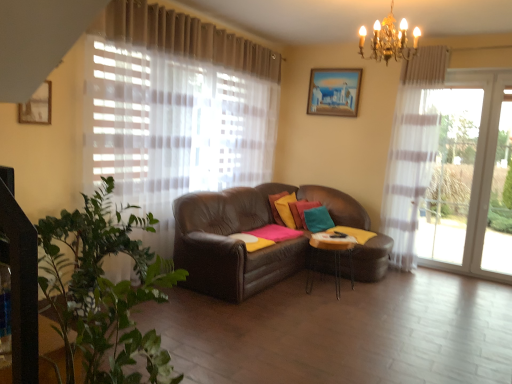
Measure the distance between point [316,97] and camera.

The depth of point [316,97] is 5.96 meters.

The image size is (512, 384). What do you see at coordinates (392, 39) in the screenshot?
I see `gold metallic chandelier at upper center` at bounding box center [392, 39].

The width and height of the screenshot is (512, 384). Find the location of `matte yellow pillow at center, acting as the 2th pillow starting from the right`. matte yellow pillow at center, acting as the 2th pillow starting from the right is located at coordinates (305, 209).

Where is `wooden picture frame at upper left, the 2th picture frame from the back`? This screenshot has width=512, height=384. wooden picture frame at upper left, the 2th picture frame from the back is located at coordinates (37, 106).

In order to click on teal fabric pillow at center, arranged as the third pillow when viewed from the left in this screenshot , I will do [318, 219].

Measure the distance between point (320, 209) and camera.

Point (320, 209) is 5.10 meters from camera.

The height and width of the screenshot is (384, 512). What do you see at coordinates (286, 209) in the screenshot?
I see `velvet yellow pillow at center, the third pillow positioned from the right` at bounding box center [286, 209].

Where is `wooden painted picture frame at upper center, which is the 2th picture frame from bottom to top`? Image resolution: width=512 pixels, height=384 pixels. wooden painted picture frame at upper center, which is the 2th picture frame from bottom to top is located at coordinates (334, 92).

Considering the relative positions of matte yellow pillow at center, which is counted as the second pillow, starting from the left, and velvet yellow pillow at center, the third pillow positioned from the right, in the image provided, is matte yellow pillow at center, which is counted as the second pillow, starting from the left, to the right of velvet yellow pillow at center, the third pillow positioned from the right, from the viewer's perspective?

Yes.

From a real-world perspective, does matte yellow pillow at center, which is counted as the second pillow, starting from the left, sit lower than velvet yellow pillow at center, the third pillow positioned from the right?

Yes, from a real-world perspective, matte yellow pillow at center, which is counted as the second pillow, starting from the left, is below velvet yellow pillow at center, the third pillow positioned from the right.

Is matte yellow pillow at center, which is counted as the second pillow, starting from the left, turned away from velvet yellow pillow at center, marked as the first pillow in a left-to-right arrangement?

Correct, matte yellow pillow at center, which is counted as the second pillow, starting from the left, is looking away from velvet yellow pillow at center, marked as the first pillow in a left-to-right arrangement.

Considering the positions of point (303, 219) and point (292, 196), is point (303, 219) closer or farther from the camera than point (292, 196)?

Clearly, point (303, 219) is closer to the camera than point (292, 196).

From the image's perspective, relative to wooden picture frame at upper left, the first picture frame viewed from the front, is teal fabric pillow at center, which ranks as the 1th pillow in right-to-left order, above or below?

teal fabric pillow at center, which ranks as the 1th pillow in right-to-left order, is situated lower than wooden picture frame at upper left, the first picture frame viewed from the front, in the image.

Is teal fabric pillow at center, arranged as the third pillow when viewed from the left, outside of wooden picture frame at upper left, positioned as the 1th picture frame in bottom-to-top order?

Indeed, teal fabric pillow at center, arranged as the third pillow when viewed from the left, is completely outside wooden picture frame at upper left, positioned as the 1th picture frame in bottom-to-top order.

Looking at this image, is teal fabric pillow at center, arranged as the third pillow when viewed from the left, far from wooden picture frame at upper left, positioned as the 1th picture frame in bottom-to-top order?

teal fabric pillow at center, arranged as the third pillow when viewed from the left, is positioned a significant distance from wooden picture frame at upper left, positioned as the 1th picture frame in bottom-to-top order.

Is teal fabric pillow at center, which ranks as the 1th pillow in right-to-left order, oriented towards wooden picture frame at upper left, the 2th picture frame from the back?

No, teal fabric pillow at center, which ranks as the 1th pillow in right-to-left order, is not aimed at wooden picture frame at upper left, the 2th picture frame from the back.

Based on the photo, which of these two, velvet yellow pillow at center, the third pillow positioned from the right, or metallic silver table at center, stands taller?

metallic silver table at center.

Is point (294, 224) closer or farther from the camera than point (340, 290)?

Point (294, 224) appears to be farther away from the viewer than point (340, 290).

Locate an element on the screen. The height and width of the screenshot is (384, 512). table below the velvet yellow pillow at center, the third pillow positioned from the right (from a real-world perspective) is located at coordinates (334, 256).

Could you tell me if velvet yellow pillow at center, marked as the first pillow in a left-to-right arrangement, is turned towards metallic silver table at center?

Yes, velvet yellow pillow at center, marked as the first pillow in a left-to-right arrangement, is facing metallic silver table at center.

Which is in front, metallic silver table at center or teal fabric pillow at center, which ranks as the 1th pillow in right-to-left order?

metallic silver table at center.

Consider the image. From a real-world perspective, who is located higher, metallic silver table at center or teal fabric pillow at center, arranged as the third pillow when viewed from the left?

teal fabric pillow at center, arranged as the third pillow when viewed from the left, from a real-world perspective.

From a real-world perspective, which object stands above the other?

In real-world perspective, gold metallic chandelier at upper center is above.

Where is `light fixture above the teal fabric pillow at center, arranged as the third pillow when viewed from the left (from a real-world perspective)`? The height and width of the screenshot is (384, 512). light fixture above the teal fabric pillow at center, arranged as the third pillow when viewed from the left (from a real-world perspective) is located at coordinates (392, 39).

Is teal fabric pillow at center, which ranks as the 1th pillow in right-to-left order, oriented away from gold metallic chandelier at upper center?

No, teal fabric pillow at center, which ranks as the 1th pillow in right-to-left order,'s orientation is not away from gold metallic chandelier at upper center.

Consider the image. Can you confirm if teal fabric pillow at center, which ranks as the 1th pillow in right-to-left order, is shorter than gold metallic chandelier at upper center?

Yes, teal fabric pillow at center, which ranks as the 1th pillow in right-to-left order, is shorter than gold metallic chandelier at upper center.

Which is more to the left, wooden painted picture frame at upper center, the first picture frame viewed from the top, or wooden picture frame at upper left, the 2th picture frame from the back?

wooden picture frame at upper left, the 2th picture frame from the back.

Does wooden painted picture frame at upper center, which is the 2th picture frame from bottom to top, turn towards wooden picture frame at upper left, which is the second picture frame from right to left?

Yes, wooden painted picture frame at upper center, which is the 2th picture frame from bottom to top, is aimed at wooden picture frame at upper left, which is the second picture frame from right to left.

From the image's perspective, is wooden painted picture frame at upper center, which is the 2th picture frame from bottom to top, positioned above or below wooden picture frame at upper left, the first picture frame viewed from the front?

wooden painted picture frame at upper center, which is the 2th picture frame from bottom to top, is above wooden picture frame at upper left, the first picture frame viewed from the front.

Considering the sizes of objects wooden painted picture frame at upper center, which is the 2th picture frame from bottom to top, and wooden picture frame at upper left, the first picture frame viewed from the front, in the image provided, who is shorter, wooden painted picture frame at upper center, which is the 2th picture frame from bottom to top, or wooden picture frame at upper left, the first picture frame viewed from the front,?

With less height is wooden picture frame at upper left, the first picture frame viewed from the front.

Is teal fabric pillow at center, arranged as the third pillow when viewed from the left, positioned far away from matte yellow pillow at center, acting as the 2th pillow starting from the right?

No, there isn't a large distance between teal fabric pillow at center, arranged as the third pillow when viewed from the left, and matte yellow pillow at center, acting as the 2th pillow starting from the right.

Is teal fabric pillow at center, arranged as the third pillow when viewed from the left, inside or outside of matte yellow pillow at center, which is counted as the second pillow, starting from the left?

teal fabric pillow at center, arranged as the third pillow when viewed from the left, is not enclosed by matte yellow pillow at center, which is counted as the second pillow, starting from the left.

From a real-world perspective, is teal fabric pillow at center, which ranks as the 1th pillow in right-to-left order, above or below matte yellow pillow at center, which is counted as the second pillow, starting from the left?

teal fabric pillow at center, which ranks as the 1th pillow in right-to-left order, is below matte yellow pillow at center, which is counted as the second pillow, starting from the left.

Considering the relative positions of teal fabric pillow at center, arranged as the third pillow when viewed from the left, and matte yellow pillow at center, acting as the 2th pillow starting from the right, in the image provided, is teal fabric pillow at center, arranged as the third pillow when viewed from the left, in front of matte yellow pillow at center, acting as the 2th pillow starting from the right,?

Yes, it is.

At what (x,y) coordinates should I click in order to perform the action: click on the 1st pillow counting from the right side of the velvet yellow pillow at center, marked as the first pillow in a left-to-right arrangement. Please return your answer as a coordinate pair (x, y). Looking at the image, I should click on (305, 209).

Locate an element on the screen. The height and width of the screenshot is (384, 512). picture frame that is the 1st one when counting upward from the teal fabric pillow at center, arranged as the third pillow when viewed from the left (from the image's perspective) is located at coordinates (37, 106).

Estimate the real-world distances between objects in this image. Which object is further from wooden painted picture frame at upper center, the first picture frame viewed from the right, teal fabric pillow at center, arranged as the third pillow when viewed from the left, or gold metallic chandelier at upper center?

Answer: Based on the image, gold metallic chandelier at upper center appears to be further to wooden painted picture frame at upper center, the first picture frame viewed from the right.

Looking at the image, which one is located further to wooden picture frame at upper left, positioned as the 1th picture frame in bottom-to-top order, wooden painted picture frame at upper center, which is the second picture frame in left-to-right order, or velvet yellow pillow at center, the third pillow positioned from the right?

wooden painted picture frame at upper center, which is the second picture frame in left-to-right order, is further to wooden picture frame at upper left, positioned as the 1th picture frame in bottom-to-top order.

Considering their positions, is matte yellow pillow at center, which is counted as the second pillow, starting from the left, positioned further to metallic silver table at center than gold metallic chandelier at upper center?

Among the two, gold metallic chandelier at upper center is located further to metallic silver table at center.

Considering their positions, is metallic silver table at center positioned closer to wooden picture frame at upper left, the 2th picture frame from the back, than teal fabric pillow at center, arranged as the third pillow when viewed from the left?

metallic silver table at center is closer to wooden picture frame at upper left, the 2th picture frame from the back.

Estimate the real-world distances between objects in this image. Which object is further from gold metallic chandelier at upper center, matte yellow pillow at center, acting as the 2th pillow starting from the right, or wooden picture frame at upper left, the first picture frame viewed from the front?

wooden picture frame at upper left, the first picture frame viewed from the front.

Based on their spatial positions, is teal fabric pillow at center, arranged as the third pillow when viewed from the left, or matte yellow pillow at center, acting as the 2th pillow starting from the right, closer to gold metallic chandelier at upper center?

Based on the image, teal fabric pillow at center, arranged as the third pillow when viewed from the left, appears to be nearer to gold metallic chandelier at upper center.

When comparing their distances from velvet yellow pillow at center, the third pillow positioned from the right, does teal fabric pillow at center, arranged as the third pillow when viewed from the left, or wooden painted picture frame at upper center, which is the second picture frame in left-to-right order, seem closer?

Among the two, teal fabric pillow at center, arranged as the third pillow when viewed from the left, is located nearer to velvet yellow pillow at center, the third pillow positioned from the right.

Considering their positions, is teal fabric pillow at center, arranged as the third pillow when viewed from the left, positioned further to metallic silver table at center than wooden painted picture frame at upper center, which is the second picture frame in left-to-right order?

wooden painted picture frame at upper center, which is the second picture frame in left-to-right order, is positioned further to the anchor metallic silver table at center.

This screenshot has width=512, height=384. Find the location of `table located between wooden picture frame at upper left, the 2th picture frame viewed from the top, and gold metallic chandelier at upper center in the left-right direction`. table located between wooden picture frame at upper left, the 2th picture frame viewed from the top, and gold metallic chandelier at upper center in the left-right direction is located at coordinates (334, 256).

In order to click on picture frame located between wooden picture frame at upper left, which is the second picture frame from right to left, and gold metallic chandelier at upper center in the left-right direction in this screenshot , I will do `click(334, 92)`.

The height and width of the screenshot is (384, 512). I want to click on pillow between metallic silver table at center and matte yellow pillow at center, acting as the 2th pillow starting from the right, along the z-axis, so click(318, 219).

At what (x,y) coordinates should I click in order to perform the action: click on table positioned between gold metallic chandelier at upper center and velvet yellow pillow at center, the third pillow positioned from the right, from near to far. Please return your answer as a coordinate pair (x, y). Looking at the image, I should click on (334, 256).